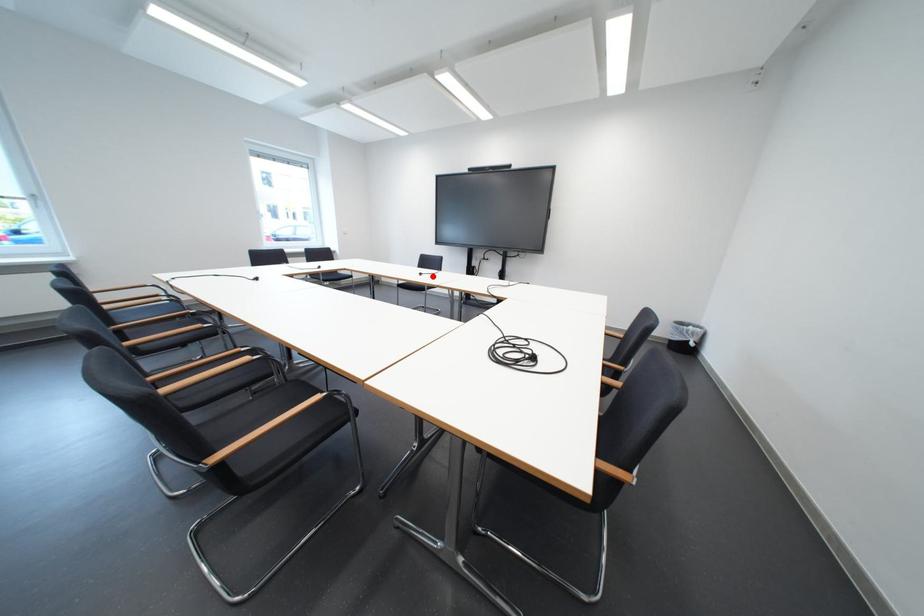
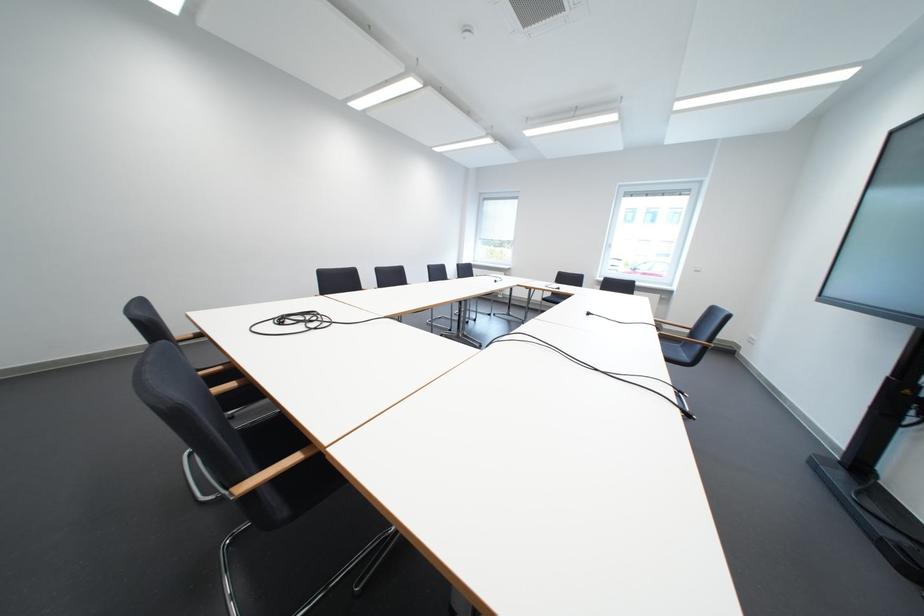
The point at the highlighted location is marked in the first image. Where is the corresponding point in the second image?

(601, 315)